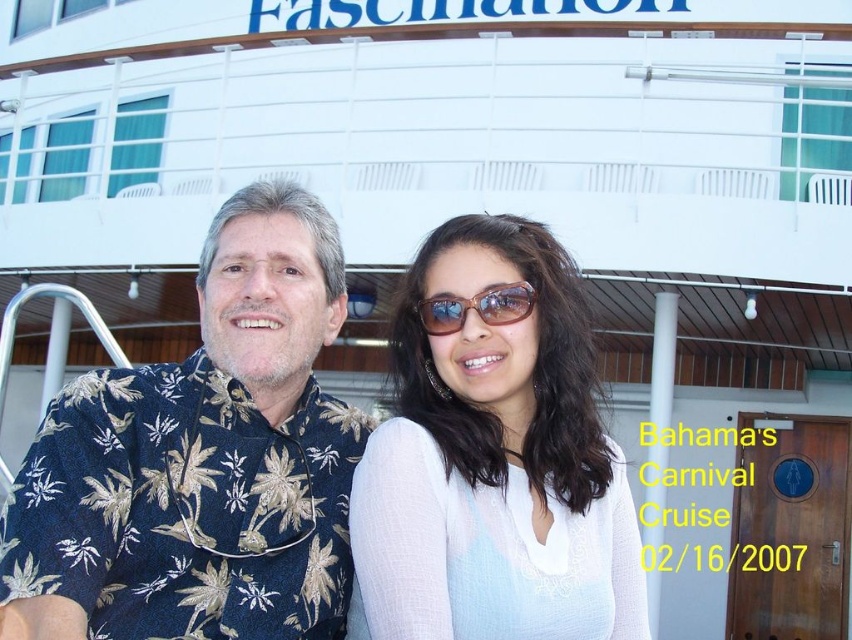
Is blue floral shirt at center bigger than white matte sunglasses at center?

No.

Which of these two, blue floral shirt at center or white matte sunglasses at center, stands taller?

Standing taller between the two is white matte sunglasses at center.

Between point (62, 518) and point (387, 540), which one is positioned behind?

Positioned behind is point (387, 540).

At what (x,y) coordinates should I click in order to perform the action: click on blue floral shirt at center. Please return your answer as a coordinate pair (x, y). This screenshot has width=852, height=640. Looking at the image, I should click on (203, 460).

Does blue floral shirt at center have a lesser height compared to sunglasses at center?

Yes.

You are a GUI agent. You are given a task and a screenshot of the screen. Output one action in this format:
    pyautogui.click(x=<x>, y=<y>)
    Task: Click on the blue floral shirt at center
    Image resolution: width=852 pixels, height=640 pixels.
    Given the screenshot: What is the action you would take?
    (x=203, y=460)

Is white matte sunglasses at center to the left of sunglasses at center from the viewer's perspective?

In fact, white matte sunglasses at center is to the right of sunglasses at center.

Is point (570, 611) farther from camera compared to point (532, 304)?

That is False.

I want to click on white matte sunglasses at center, so click(494, 456).